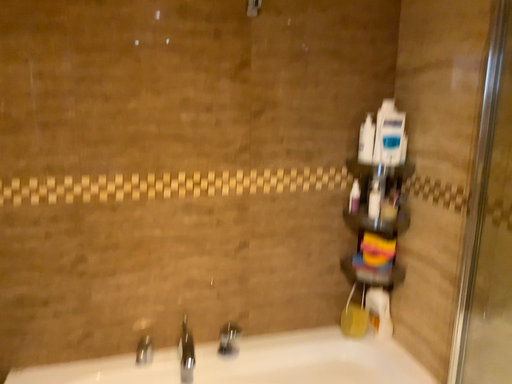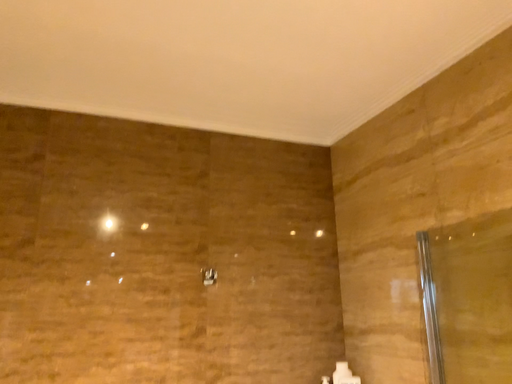
Question: How did the camera likely rotate when shooting the video?

Choices:
 (A) rotated upward
 (B) rotated downward

Answer: (A)